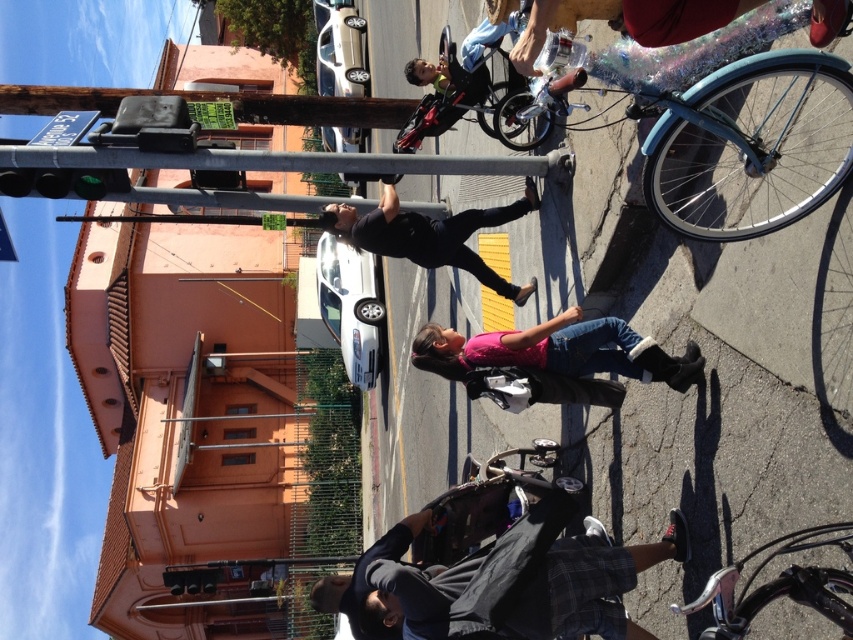
Question: Is shiny blue bicycle at right behind shiny metallic bicycle at lower right?

Choices:
 (A) no
 (B) yes

Answer: (B)

Question: Can you confirm if pink matte shirt at center is wider than metallic silver pole at upper center?

Choices:
 (A) yes
 (B) no

Answer: (B)

Question: Is shiny blue bicycle at right to the left of metallic silver pole at upper center from the viewer's perspective?

Choices:
 (A) yes
 (B) no

Answer: (B)

Question: Which object is the closest to the black matte pants at center?

Choices:
 (A) dark gray shirt at lower center
 (B) pink matte shirt at center

Answer: (B)

Question: Among these points, which one is farthest from the camera?

Choices:
 (A) click(409, 540)
 (B) click(6, 150)

Answer: (B)

Question: Estimate the real-world distances between objects in this image. Which object is closer to the dark gray shirt at lower center?

Choices:
 (A) metallic silver pole at upper center
 (B) black matte pants at center

Answer: (B)